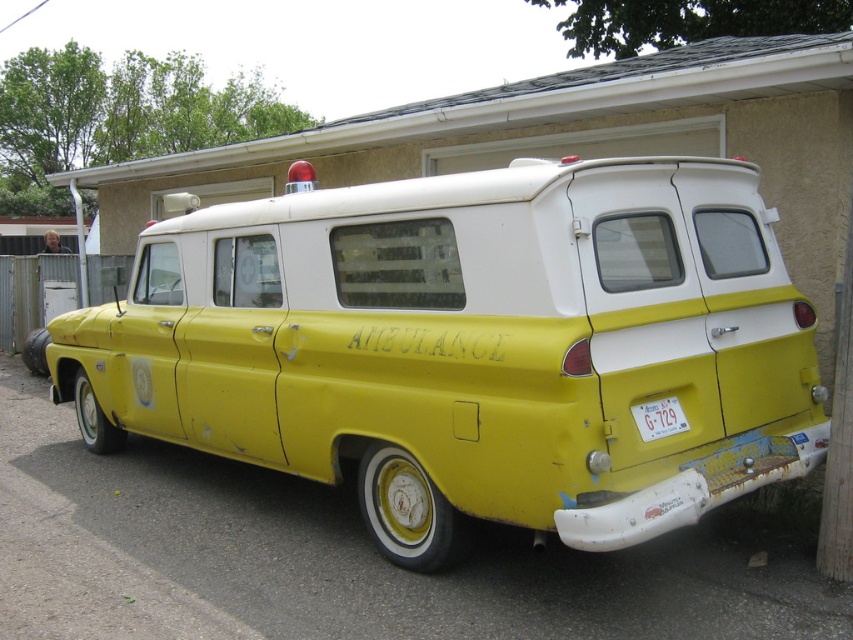
Question: Is yellow matte van at center smaller than white plastic license plate at rear?

Choices:
 (A) yes
 (B) no

Answer: (B)

Question: Which object appears farthest from the camera in this image?

Choices:
 (A) white plastic license plate at rear
 (B) yellow matte van at center

Answer: (A)

Question: Does yellow matte van at center have a larger size compared to white plastic license plate at rear?

Choices:
 (A) yes
 (B) no

Answer: (A)

Question: Is yellow matte van at center below white plastic license plate at rear?

Choices:
 (A) no
 (B) yes

Answer: (A)

Question: Which object appears closest to the camera in this image?

Choices:
 (A) white plastic license plate at rear
 (B) yellow matte van at center

Answer: (B)